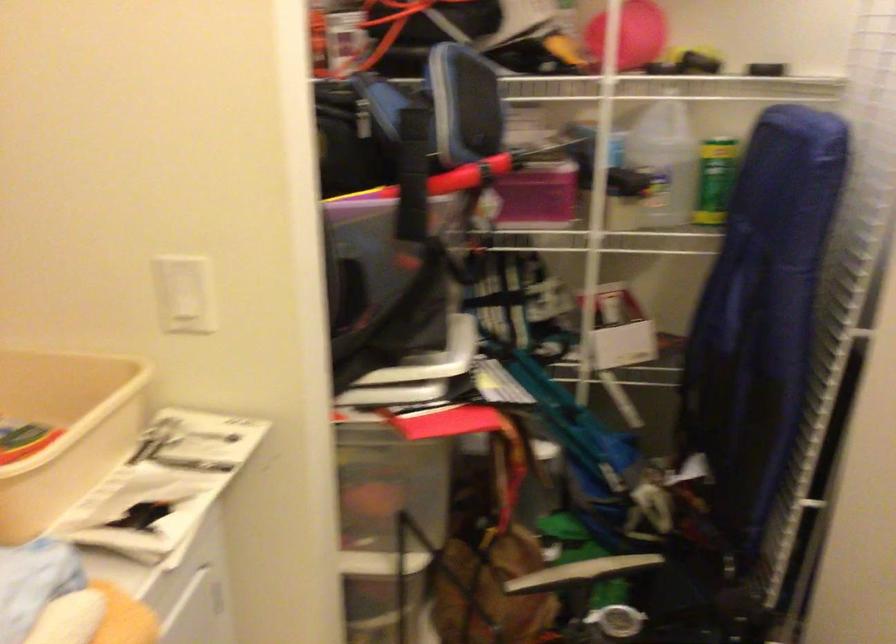
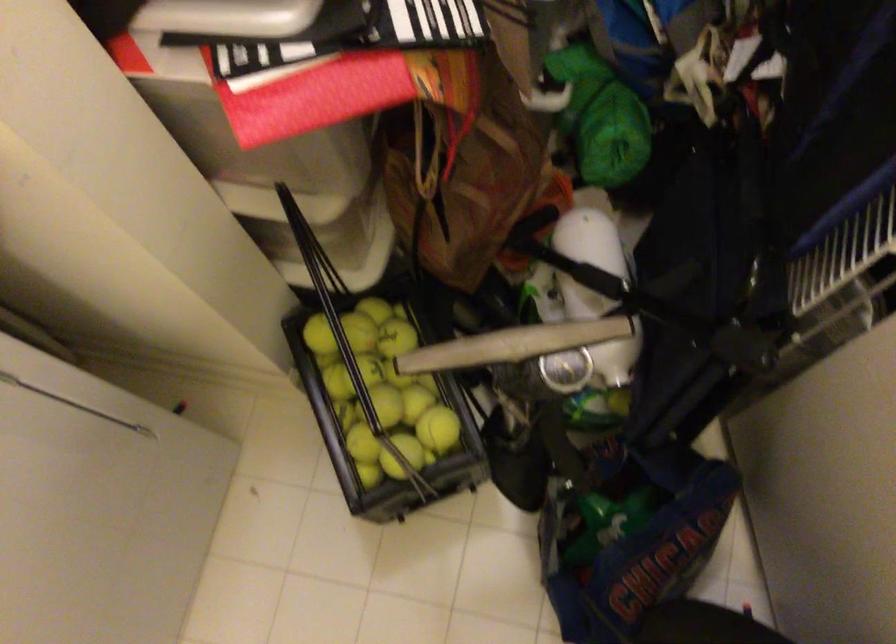
Locate, in the second image, the point that corresponds to pixel 586 573 in the first image.

(513, 345)